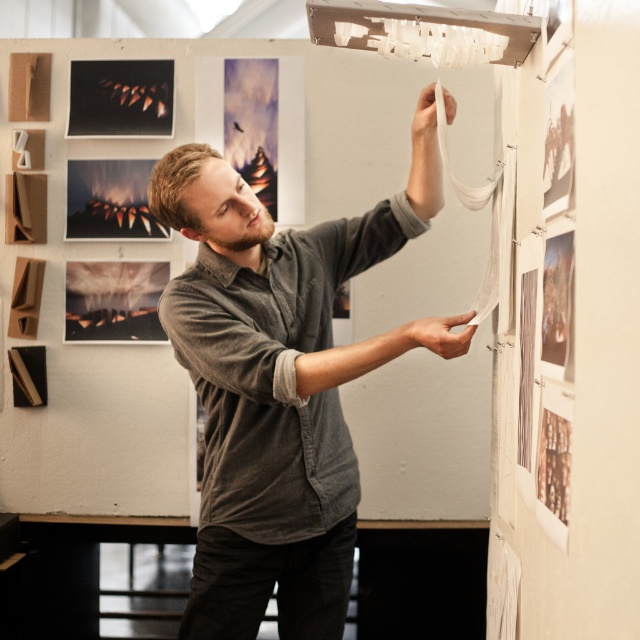
Does matte black paper at upper left have a greater height compared to matte black photograph at lower left?

No, matte black paper at upper left is not taller than matte black photograph at lower left.

Can you confirm if matte black paper at upper left is smaller than matte black photograph at lower left?

Yes.

Is point (80, 120) farther from camera compared to point (166, 276)?

Yes, it is behind point (166, 276).

The height and width of the screenshot is (640, 640). Find the location of `matte black paper at upper left`. matte black paper at upper left is located at coordinates (120, 97).

Between point (164, 100) and point (136, 193), which one is positioned behind?

Positioned behind is point (136, 193).

Is point (168, 72) more distant than point (86, 204)?

Yes, point (168, 72) is behind point (86, 204).

Image resolution: width=640 pixels, height=640 pixels. What are the coordinates of `matte black paper at upper left` in the screenshot? It's located at (120, 97).

Between gray cotton shirt at center and matte black photograph at lower left, which one appears on the right side from the viewer's perspective?

Positioned to the right is gray cotton shirt at center.

Locate an element on the screen. The width and height of the screenshot is (640, 640). gray cotton shirt at center is located at coordinates (280, 384).